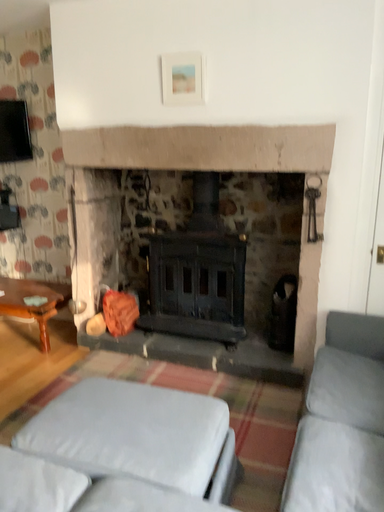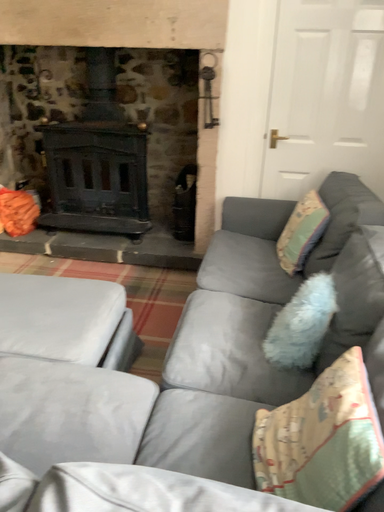
Question: How did the camera likely rotate when shooting the video?

Choices:
 (A) rotated upward
 (B) rotated downward

Answer: (B)